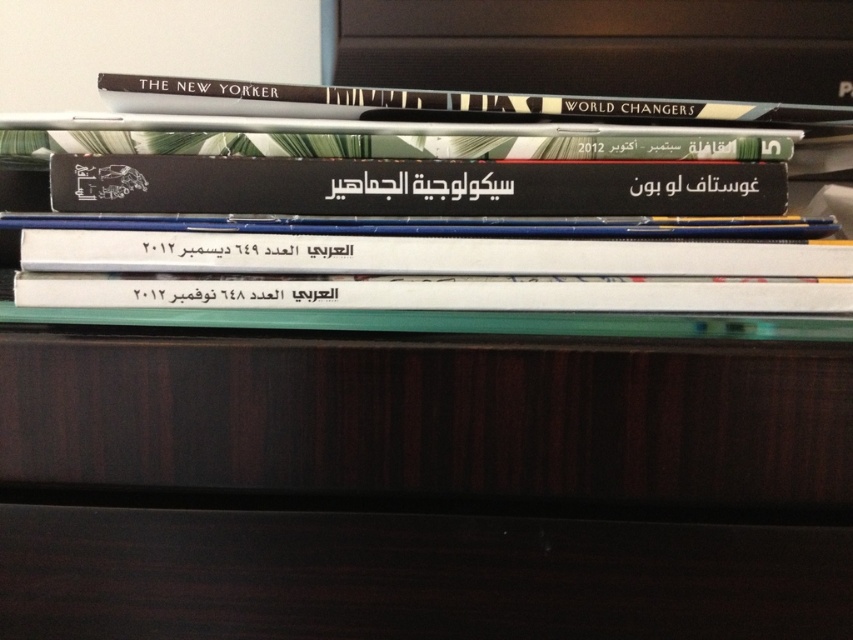
You are organizing a library shelf and need to place the black matte book at center and the hardcover book at upper center. According to the image, which book should be placed on top to maintain the existing arrangement?

The hardcover book at upper center should be placed on top because the black matte book at center is below it in the image.

You have a small decorative item that is 1.5 inches wide. You want to place it between the black matte book at center and the hardcover book at upper center. Will it fit without overlapping either book?

The black matte book at center and hardcover book at upper center are 1.69 inches apart from each other. Since the decorative item is 1.5 inches wide, it will fit between them without overlapping either book.

You are organizing a library and need to place the black matte book at center and the hardcover book at upper center on a shelf. Based on their positions, which book should you place first to ensure proper stacking?

You should place the hardcover book at upper center first because the black matte book at center is closer to the viewer, meaning it is stacked on top of the hardcover book at upper center.